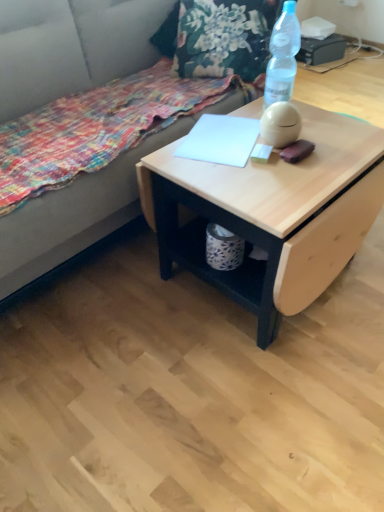
Question: Is fabric couch at upper left completely or partially inside natural wood desk at center?

Choices:
 (A) no
 (B) yes

Answer: (A)

Question: Does natural wood desk at center have a larger size compared to fabric couch at upper left?

Choices:
 (A) no
 (B) yes

Answer: (A)

Question: Considering the relative sizes of natural wood desk at center and fabric couch at upper left in the image provided, is natural wood desk at center thinner than fabric couch at upper left?

Choices:
 (A) yes
 (B) no

Answer: (A)

Question: Does natural wood desk at center have a greater height compared to fabric couch at upper left?

Choices:
 (A) no
 (B) yes

Answer: (A)

Question: Can you confirm if natural wood desk at center is positioned to the right of fabric couch at upper left?

Choices:
 (A) yes
 (B) no

Answer: (A)

Question: Is natural wood desk at center outside fabric couch at upper left?

Choices:
 (A) no
 (B) yes

Answer: (B)

Question: Are fabric couch at upper left and natural wood desk at center beside each other?

Choices:
 (A) no
 (B) yes

Answer: (A)

Question: Can natural wood desk at center be found inside fabric couch at upper left?

Choices:
 (A) no
 (B) yes

Answer: (A)

Question: Does fabric couch at upper left have a lesser height compared to natural wood desk at center?

Choices:
 (A) yes
 (B) no

Answer: (B)

Question: Does fabric couch at upper left come behind natural wood desk at center?

Choices:
 (A) yes
 (B) no

Answer: (B)

Question: From the image's perspective, is fabric couch at upper left beneath natural wood desk at center?

Choices:
 (A) yes
 (B) no

Answer: (B)

Question: From the image's perspective, is fabric couch at upper left on top of natural wood desk at center?

Choices:
 (A) no
 (B) yes

Answer: (B)

Question: Does transparent plastic bottle at upper right come in front of floral fabric blanket at lower left?

Choices:
 (A) no
 (B) yes

Answer: (A)